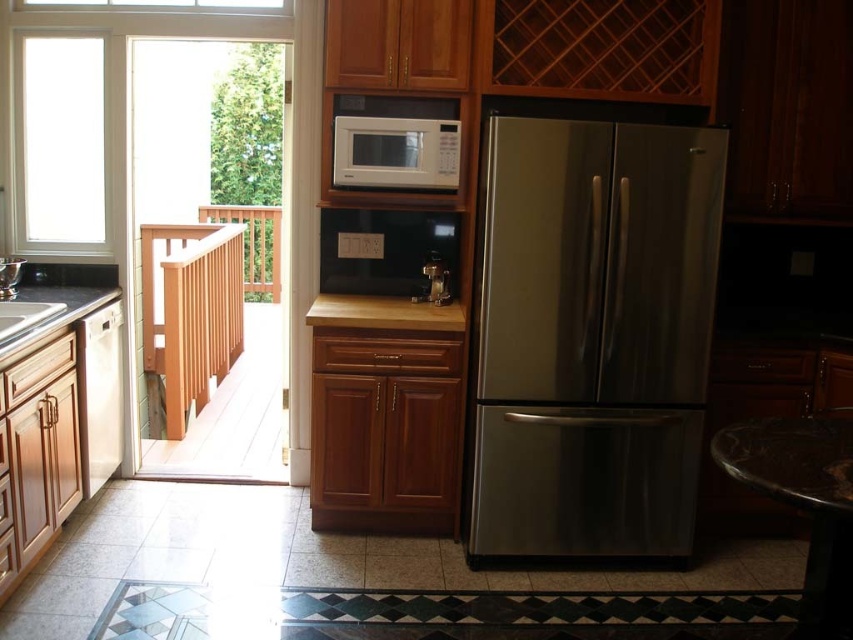
From the picture: Who is positioned more to the left, stainless steel refrigerator at center or metallic silver coffee maker at center?

metallic silver coffee maker at center

Does stainless steel refrigerator at center lie in front of metallic silver coffee maker at center?

Yes, stainless steel refrigerator at center is closer to the viewer.

Between point (500, 417) and point (444, 266), which one is positioned behind?

Point (444, 266)

This screenshot has width=853, height=640. In order to click on stainless steel refrigerator at center in this screenshot , I will do `click(593, 337)`.

Can you confirm if wooden stool at lower right is taller than black granite countertop at lower left?

Yes, wooden stool at lower right is taller than black granite countertop at lower left.

Who is more forward, (804, 444) or (86, 296)?

Positioned in front is point (804, 444).

Is point (837, 449) positioned in front of point (42, 333)?

Yes, point (837, 449) is in front of point (42, 333).

The width and height of the screenshot is (853, 640). What are the coordinates of `wooden stool at lower right` in the screenshot? It's located at point(804,502).

Does white matte microwave at center have a lesser height compared to metallic silver coffee maker at center?

Incorrect, white matte microwave at center's height does not fall short of metallic silver coffee maker at center's.

Between white matte microwave at center and metallic silver coffee maker at center, which one has less height?

With less height is metallic silver coffee maker at center.

This screenshot has height=640, width=853. Describe the element at coordinates (396, 152) in the screenshot. I see `white matte microwave at center` at that location.

At what (x,y) coordinates should I click in order to perform the action: click on white matte microwave at center. Please return your answer as a coordinate pair (x, y). This screenshot has height=640, width=853. Looking at the image, I should click on (396, 152).